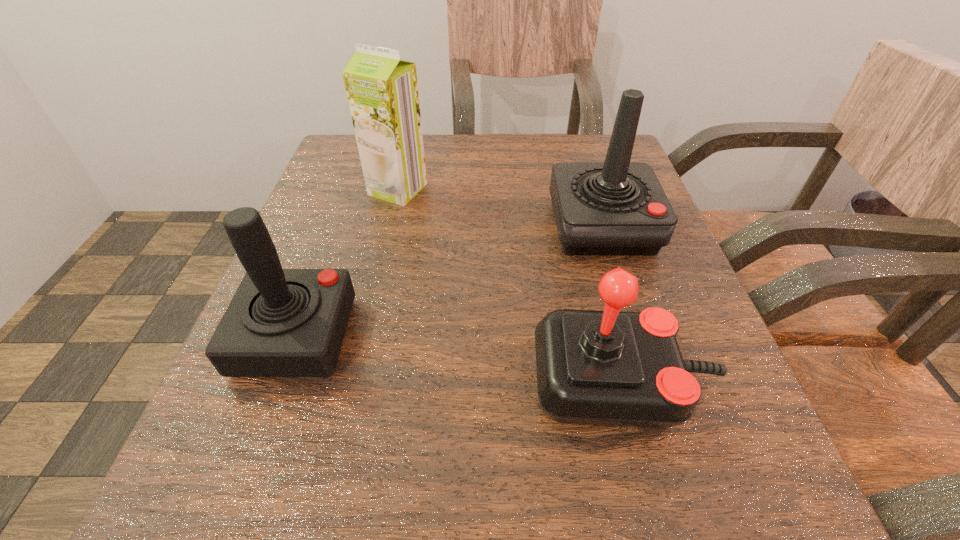
Find the location of `vacant point located between the soya milk and the leftmost joystick`. vacant point located between the soya milk and the leftmost joystick is located at coordinates (347, 263).

Where is `empty location between the soya milk and the leftmost joystick`? empty location between the soya milk and the leftmost joystick is located at coordinates (347, 263).

Locate an element on the screen. The image size is (960, 540). vacant area between the soya milk and the farthest joystick is located at coordinates (500, 208).

Locate an element on the screen. This screenshot has width=960, height=540. object that is the second closest to the farthest joystick is located at coordinates (382, 90).

Locate an element on the screen. This screenshot has height=540, width=960. object that is the closest to the soya milk is located at coordinates (280, 322).

The width and height of the screenshot is (960, 540). I want to click on the third closest joystick relative to the soya milk, so click(x=610, y=368).

Locate which joystick is the closest to the leftmost joystick. Please provide its 2D coordinates. Your answer should be formatted as a tuple, i.e. [(x, y)], where the tuple contains the x and y coordinates of a point satisfying the conditions above.

[(610, 368)]

This screenshot has height=540, width=960. In order to click on vacant region that satisfies the following two spatial constraints: 1. on the front-facing side of the farthest joystick; 2. on the base of the leftmost joystick in this screenshot , I will do `click(636, 336)`.

Where is `vacant position in the image that satisfies the following two spatial constraints: 1. on the front-facing side of the farthest joystick; 2. on the base of the leftmost joystick`? vacant position in the image that satisfies the following two spatial constraints: 1. on the front-facing side of the farthest joystick; 2. on the base of the leftmost joystick is located at coordinates (636, 336).